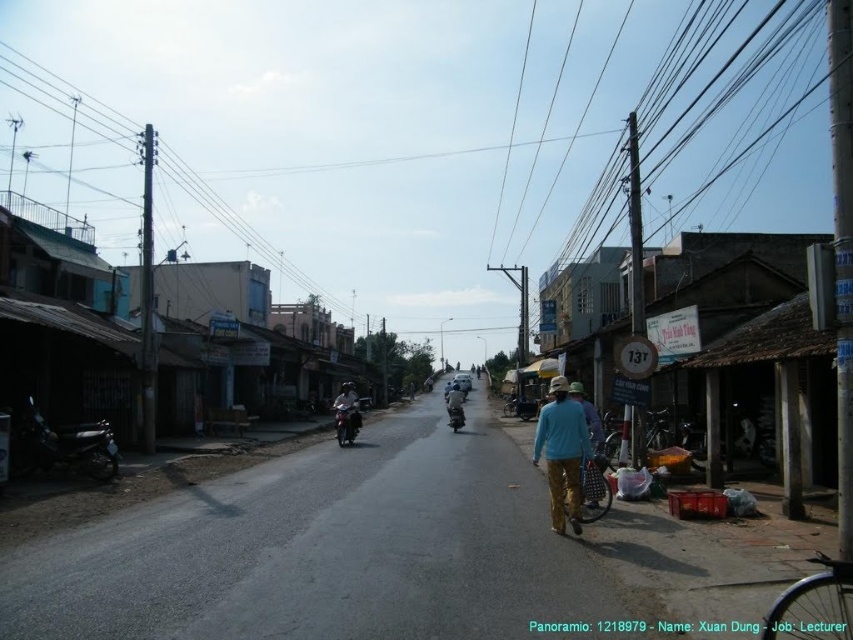
You are a delivery person trying to navigate through the street shown in the image. You need to pass between the metallic wire at upper left and the matte black motorcycle at center. Can you safely pass through without touching either object?

The metallic wire at upper left is bigger than the matte black motorcycle at center, so there might be enough space to pass through without touching either object. However, the exact distance isn not specified, so caution is advised.